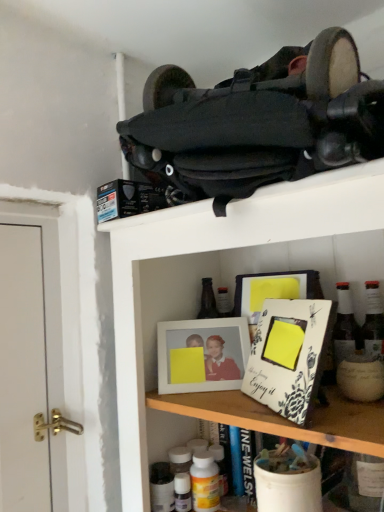
Question: Is white matte picture frame at center to the left or to the right of yellow matte bottle at lower center in the image?

Choices:
 (A) right
 (B) left

Answer: (B)

Question: Is white matte picture frame at center in front of or behind yellow matte bottle at lower center in the image?

Choices:
 (A) behind
 (B) front

Answer: (A)

Question: Would you say white matte picture frame at center is inside or outside yellow matte bottle at lower center?

Choices:
 (A) inside
 (B) outside

Answer: (B)

Question: Based on their sizes in the image, would you say yellow matte bottle at lower center is bigger or smaller than white matte picture frame at center?

Choices:
 (A) big
 (B) small

Answer: (B)

Question: Is point (195, 497) positioned closer to the camera than point (241, 351)?

Choices:
 (A) farther
 (B) closer

Answer: (B)

Question: From the image's perspective, is yellow matte bottle at lower center positioned above or below white matte picture frame at center?

Choices:
 (A) above
 (B) below

Answer: (B)

Question: Based on their positions, is yellow matte bottle at lower center located to the left or right of white matte picture frame at center?

Choices:
 (A) right
 (B) left

Answer: (A)